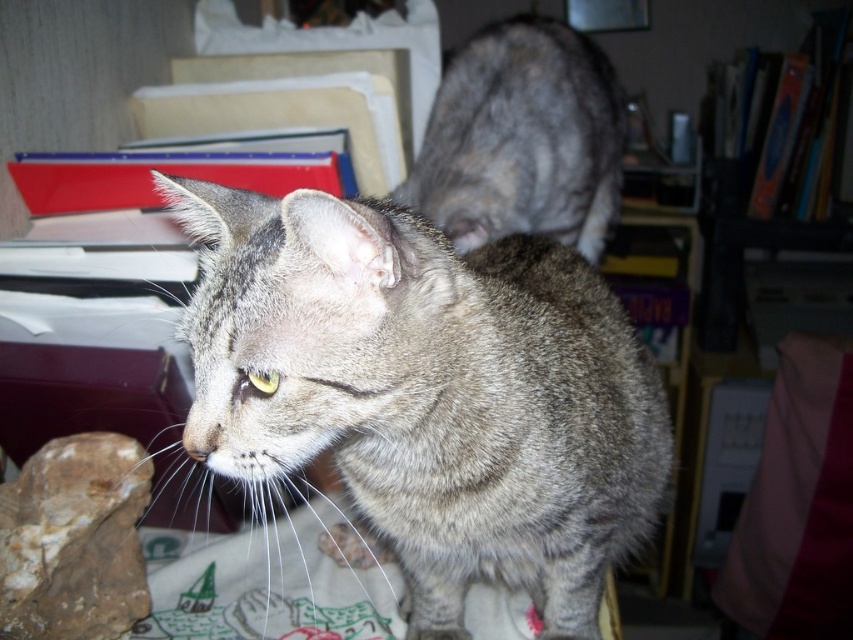
Question: Which is farther from the brown rough rock at lower left?

Choices:
 (A) gray tabby cat at center
 (B) gray tabby cat at upper center

Answer: (B)

Question: Is gray tabby cat at center smaller than brown rough rock at lower left?

Choices:
 (A) no
 (B) yes

Answer: (A)

Question: Which point is farther to the camera?

Choices:
 (A) gray tabby cat at center
 (B) gray tabby cat at upper center

Answer: (B)

Question: Which object appears farthest from the camera in this image?

Choices:
 (A) gray tabby cat at upper center
 (B) brown rough rock at lower left
 (C) gray tabby cat at center

Answer: (A)

Question: From the image, what is the correct spatial relationship of gray tabby cat at center in relation to brown rough rock at lower left?

Choices:
 (A) left
 (B) right

Answer: (B)

Question: Can you confirm if gray tabby cat at center is positioned below brown rough rock at lower left?

Choices:
 (A) no
 (B) yes

Answer: (A)